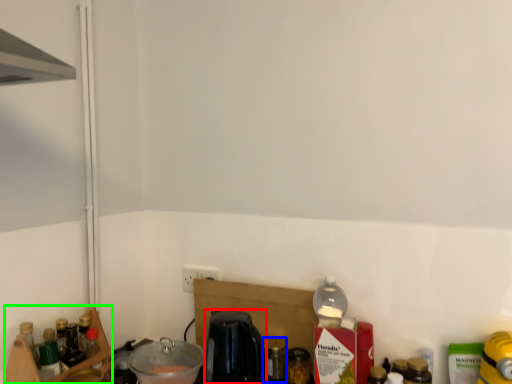
Question: Based on their relative distances, which object is nearer to coffee machine (highlighted by a red box)? Choose from bottle (highlighted by a blue box) and shelf (highlighted by a green box).

Choices:
 (A) bottle
 (B) shelf

Answer: (A)